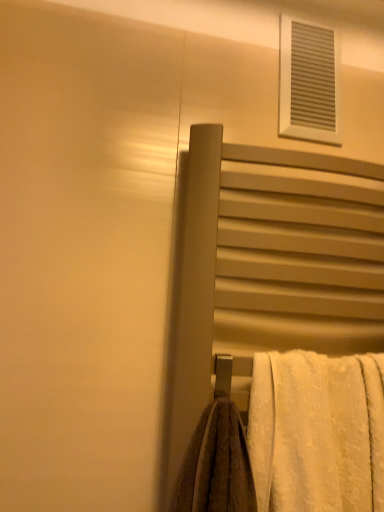
Question: Is white textured vent at upper right at the back of matte gray towel rack at center-right?

Choices:
 (A) yes
 (B) no

Answer: (B)

Question: Is matte gray towel rack at center-right positioned in front of white textured vent at upper right?

Choices:
 (A) yes
 (B) no

Answer: (A)

Question: Could white textured vent at upper right be considered to be inside matte gray towel rack at center-right?

Choices:
 (A) yes
 (B) no

Answer: (B)

Question: Is matte gray towel rack at center-right thinner than white textured vent at upper right?

Choices:
 (A) no
 (B) yes

Answer: (A)

Question: Considering the relative sizes of matte gray towel rack at center-right and white textured vent at upper right in the image provided, is matte gray towel rack at center-right taller than white textured vent at upper right?

Choices:
 (A) no
 (B) yes

Answer: (B)

Question: From the image's perspective, is matte gray towel rack at center-right positioned above or below white textured vent at upper right?

Choices:
 (A) above
 (B) below

Answer: (B)

Question: Considering the positions of matte gray towel rack at center-right and white textured vent at upper right in the image, is matte gray towel rack at center-right bigger or smaller than white textured vent at upper right?

Choices:
 (A) small
 (B) big

Answer: (B)

Question: Is matte gray towel rack at center-right to the left or to the right of white textured vent at upper right in the image?

Choices:
 (A) left
 (B) right

Answer: (A)

Question: Do you think matte gray towel rack at center-right is within white textured vent at upper right, or outside of it?

Choices:
 (A) outside
 (B) inside

Answer: (A)

Question: Is matte gray towel rack at center-right to the left or to the right of white fluffy towel at lower right in the image?

Choices:
 (A) left
 (B) right

Answer: (A)

Question: Which is correct: matte gray towel rack at center-right is inside white fluffy towel at lower right, or outside of it?

Choices:
 (A) inside
 (B) outside

Answer: (B)

Question: In terms of size, does matte gray towel rack at center-right appear bigger or smaller than white fluffy towel at lower right?

Choices:
 (A) big
 (B) small

Answer: (A)

Question: From a real-world perspective, relative to white fluffy towel at lower right, is matte gray towel rack at center-right vertically above or below?

Choices:
 (A) below
 (B) above

Answer: (B)

Question: Is point (347, 490) closer or farther from the camera than point (332, 51)?

Choices:
 (A) closer
 (B) farther

Answer: (A)

Question: Is white fluffy towel at lower right taller or shorter than white textured vent at upper right?

Choices:
 (A) short
 (B) tall

Answer: (B)